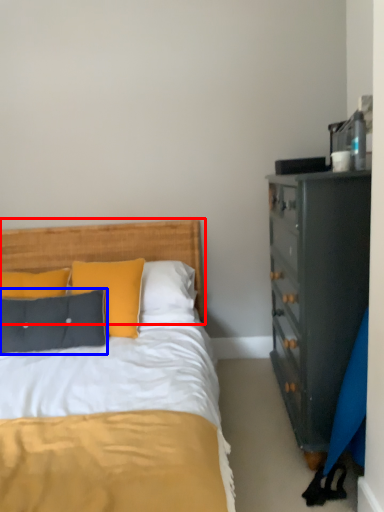
Question: Among these objects, which one is nearest to the camera, headboard (highlighted by a red box) or pillow (highlighted by a blue box)?

Choices:
 (A) headboard
 (B) pillow

Answer: (B)